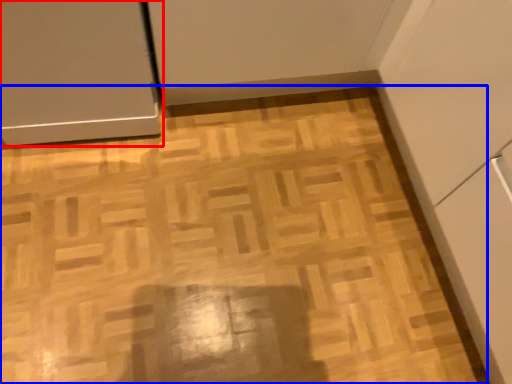
Question: Which object is closer to the camera taking this photo, door (highlighted by a red box) or plywood (highlighted by a blue box)?

Choices:
 (A) door
 (B) plywood

Answer: (A)